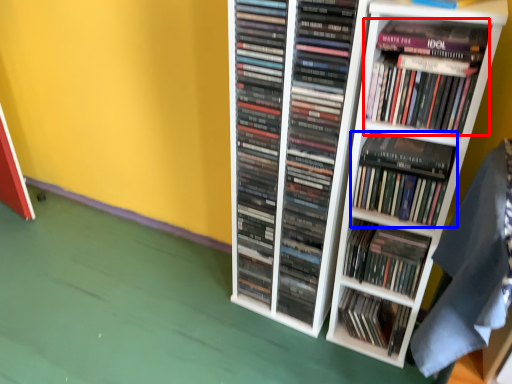
Question: Which of the following is the farthest to the observer, book (highlighted by a red box) or book (highlighted by a blue box)?

Choices:
 (A) book
 (B) book

Answer: (B)